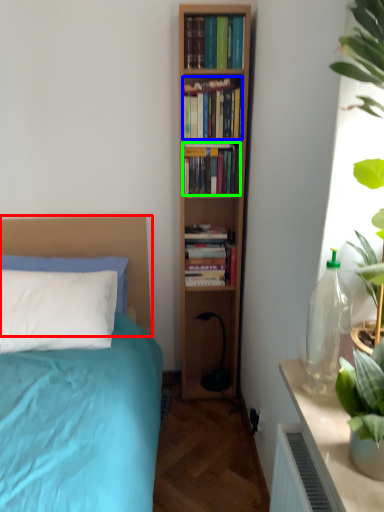
Question: Based on their relative distances, which object is farther from headboard (highlighted by a red box)? Choose from book (highlighted by a blue box) and book (highlighted by a green box).

Choices:
 (A) book
 (B) book

Answer: (A)